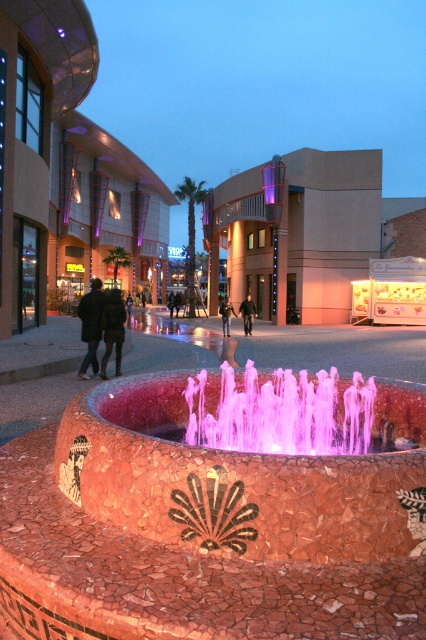
Does pink mosaic fountain at center appear over dark brown leather jacket at lower left?

Actually, pink mosaic fountain at center is below dark brown leather jacket at lower left.

Is pink mosaic fountain at center below dark brown leather jacket at lower left?

Yes, pink mosaic fountain at center is below dark brown leather jacket at lower left.

The image size is (426, 640). In order to click on pink mosaic fountain at center in this screenshot , I will do pos(242,477).

Who is shorter, pink mosaic fountain at center or dark green fabric jacket at left?

pink mosaic fountain at center

Which is behind, point (236, 529) or point (123, 310)?

The point (123, 310) is behind.

Locate an element on the screen. pink mosaic fountain at center is located at coordinates pyautogui.click(x=242, y=477).

Between dark brown leather jacket at lower left and dark brown leather jacket at center, which one appears on the right side from the viewer's perspective?

Positioned to the right is dark brown leather jacket at center.

Locate an element on the screen. The image size is (426, 640). dark brown leather jacket at lower left is located at coordinates [x=91, y=324].